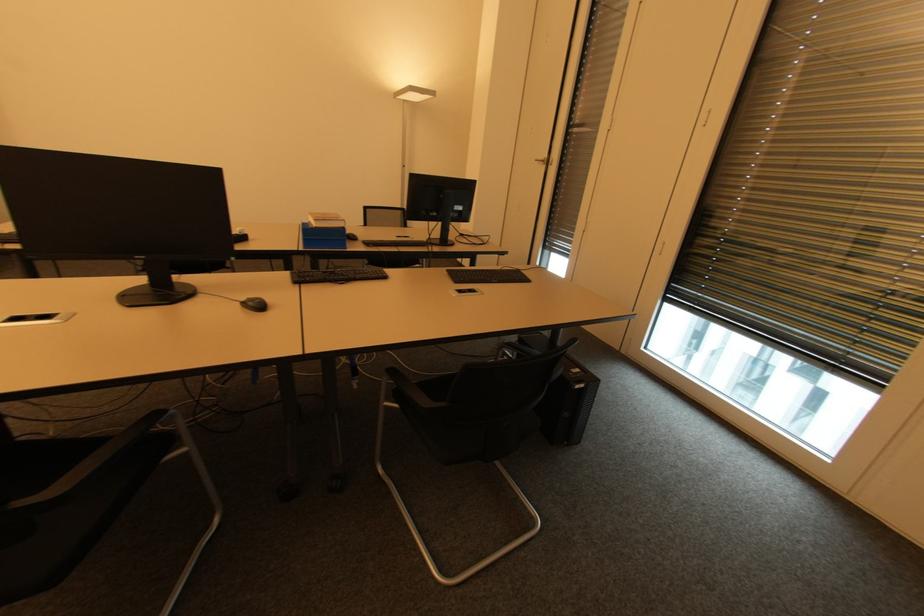
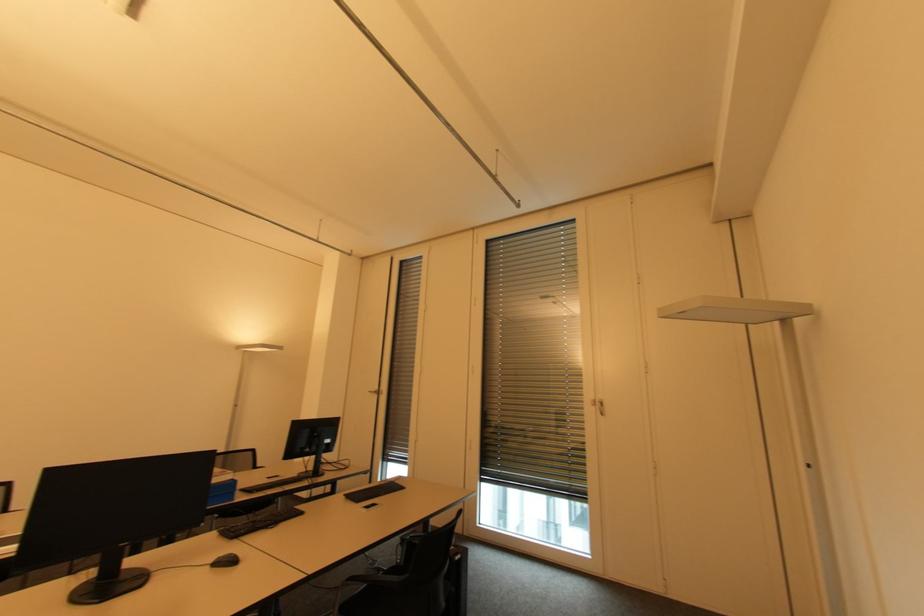
In the second image, find the point that corresponds to (670,291) in the first image.

(483, 474)